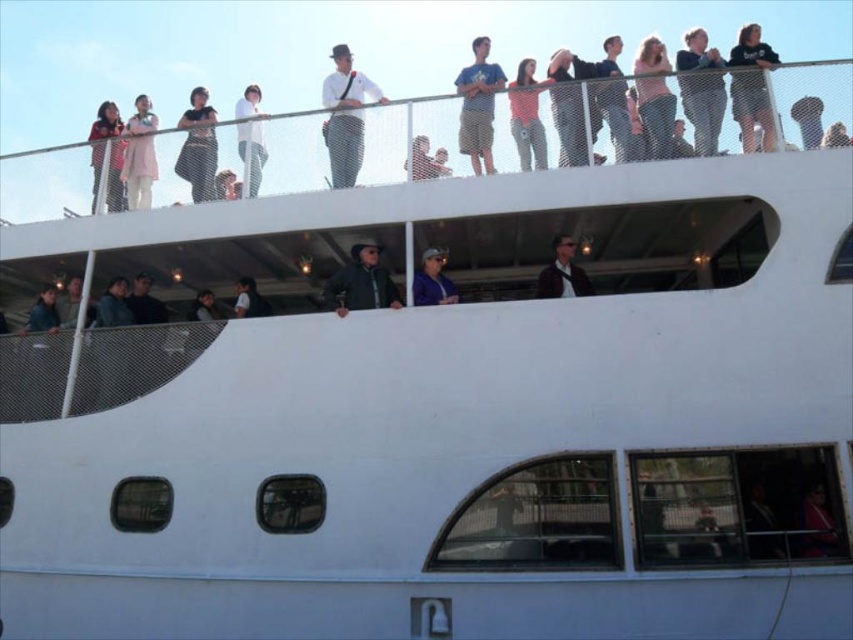
Does matte black jacket at upper left have a greater height compared to matte blue shirt at upper center?

Incorrect, matte black jacket at upper left's height is not larger of matte blue shirt at upper center's.

Which is behind, point (119, 164) or point (418, 278)?

Positioned behind is point (119, 164).

This screenshot has height=640, width=853. What are the coordinates of `matte black jacket at upper left` in the screenshot? It's located at (109, 154).

Is white textured pants at upper center closer to the viewer compared to light blue denim shorts at upper center?

No, white textured pants at upper center is behind light blue denim shorts at upper center.

Is point (328, 128) closer to viewer compared to point (466, 93)?

No.

Does point (328, 144) lie in front of point (466, 93)?

Yes, it is.

You are a GUI agent. You are given a task and a screenshot of the screen. Output one action in this format:
    pyautogui.click(x=<x>, y=<y>)
    Task: Click on the white textured pants at upper center
    
    Given the screenshot: What is the action you would take?
    pyautogui.click(x=345, y=115)

The width and height of the screenshot is (853, 640). Describe the element at coordinates (345, 115) in the screenshot. I see `white textured pants at upper center` at that location.

Is white textured pants at upper center bigger than matte black jacket at upper center?

No.

Is point (334, 120) in front of point (569, 243)?

No.

This screenshot has height=640, width=853. In order to click on white textured pants at upper center in this screenshot , I will do `click(345, 115)`.